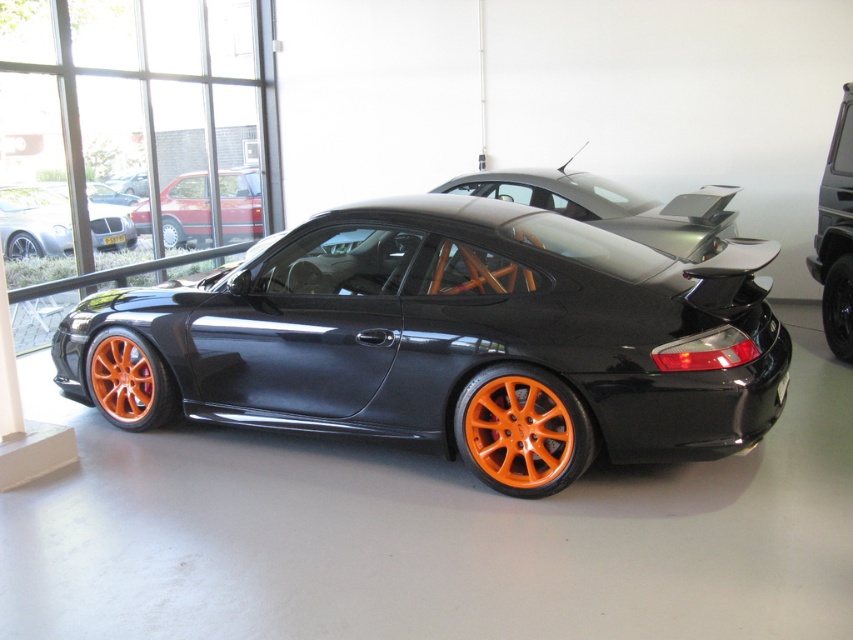
Question: From the image, what is the correct spatial relationship of matte black sports car at center in relation to orange matte tire at center?

Choices:
 (A) left
 (B) right

Answer: (B)

Question: Which object is farther from the camera taking this photo?

Choices:
 (A) matte orange wheels at center
 (B) orange matte wheel at lower left
 (C) black rubber wheel at center
 (D) orange matte wheel at center

Answer: (D)

Question: Is orange matte wheel at lower center positioned in front of black matte/satin car at right?

Choices:
 (A) yes
 (B) no

Answer: (A)

Question: Which point is farther to the camera?

Choices:
 (A) matte black sports car at center
 (B) orange metallic wheel at lower left
 (C) black rubber wheel at center
 (D) black matte/satin car at right

Answer: (C)

Question: Considering the real-world distances, which object is farthest from the orange metallic wheel at lower left?

Choices:
 (A) matte black sports car at center
 (B) orange matte wheel at lower left
 (C) matte black car at left
 (D) matte orange wheels at center

Answer: (C)

Question: Does matte orange wheels at center have a smaller size compared to black rubber wheel at center?

Choices:
 (A) yes
 (B) no

Answer: (B)